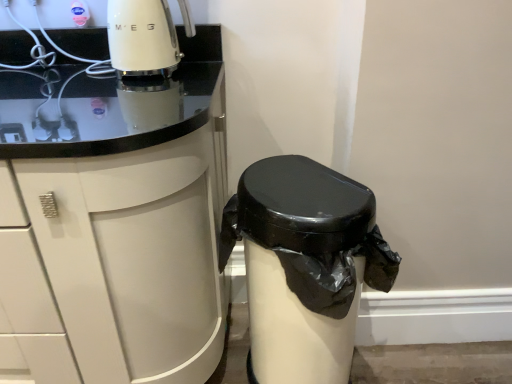
What do you see at coordinates (304, 266) in the screenshot? The width and height of the screenshot is (512, 384). I see `black plastic waste bin at lower right` at bounding box center [304, 266].

At what (x,y) coordinates should I click in order to perform the action: click on black plastic waste bin at lower right. Please return your answer as a coordinate pair (x, y). The width and height of the screenshot is (512, 384). Looking at the image, I should click on (304, 266).

What is the approximate height of white glossy cabinet at upper left?

The height of white glossy cabinet at upper left is 3.31 feet.

The width and height of the screenshot is (512, 384). Identify the location of white glossy cabinet at upper left. (135, 255).

The image size is (512, 384). Describe the element at coordinates (135, 255) in the screenshot. I see `white glossy cabinet at upper left` at that location.

Find the location of a particular element. The width and height of the screenshot is (512, 384). black plastic waste bin at lower right is located at coordinates (304, 266).

Considering the relative positions of white glossy cabinet at upper left and black plastic waste bin at lower right in the image provided, is white glossy cabinet at upper left to the left of black plastic waste bin at lower right from the viewer's perspective?

Correct, you'll find white glossy cabinet at upper left to the left of black plastic waste bin at lower right.

Which object is closer to the camera taking this photo, white glossy cabinet at upper left or black plastic waste bin at lower right?

white glossy cabinet at upper left is in front.

Which is behind, point (189, 145) or point (252, 195)?

Positioned behind is point (252, 195).

From the image's perspective, is white glossy cabinet at upper left on top of black plastic waste bin at lower right?

Yes, from the image's perspective, white glossy cabinet at upper left is on top of black plastic waste bin at lower right.

From a real-world perspective, is white glossy cabinet at upper left over black plastic waste bin at lower right?

Yes.

Between white glossy cabinet at upper left and black plastic waste bin at lower right, which one has smaller width?

black plastic waste bin at lower right.

Between white glossy cabinet at upper left and black plastic waste bin at lower right, which one has less height?

black plastic waste bin at lower right is shorter.

Considering the sizes of objects white glossy cabinet at upper left and black plastic waste bin at lower right in the image provided, who is bigger, white glossy cabinet at upper left or black plastic waste bin at lower right?

Bigger between the two is white glossy cabinet at upper left.

Is white glossy cabinet at upper left outside of black plastic waste bin at lower right?

That's correct, white glossy cabinet at upper left is outside of black plastic waste bin at lower right.

Is white glossy cabinet at upper left next to black plastic waste bin at lower right?

No, white glossy cabinet at upper left is not in contact with black plastic waste bin at lower right.

Is white glossy cabinet at upper left turned away from black plastic waste bin at lower right?

No, white glossy cabinet at upper left is not facing away from black plastic waste bin at lower right.

How far apart are white glossy cabinet at upper left and black plastic waste bin at lower right?

They are 9.58 inches apart.

Locate an element on the screen. cabinetry in front of the black plastic waste bin at lower right is located at coordinates (135, 255).

Considering the relative positions of black plastic waste bin at lower right and white glossy cabinet at upper left in the image provided, is black plastic waste bin at lower right to the left or to the right of white glossy cabinet at upper left?

In the image, black plastic waste bin at lower right appears on the right side of white glossy cabinet at upper left.

Who is more distant, black plastic waste bin at lower right or white glossy cabinet at upper left?

black plastic waste bin at lower right is more distant.

Does point (356, 200) come in front of point (145, 248)?

No, (356, 200) is further to viewer.

From the image's perspective, which object appears higher, black plastic waste bin at lower right or white glossy cabinet at upper left?

white glossy cabinet at upper left appears higher in the image.

Consider the image. From a real-world perspective, is black plastic waste bin at lower right on white glossy cabinet at upper left?

No, from a real-world perspective, black plastic waste bin at lower right is not above white glossy cabinet at upper left.

Considering the sizes of black plastic waste bin at lower right and white glossy cabinet at upper left in the image, is black plastic waste bin at lower right wider or thinner than white glossy cabinet at upper left?

black plastic waste bin at lower right is thinner than white glossy cabinet at upper left.

Does black plastic waste bin at lower right have a lesser height compared to white glossy cabinet at upper left?

Yes, black plastic waste bin at lower right is shorter than white glossy cabinet at upper left.

Can you confirm if black plastic waste bin at lower right is bigger than white glossy cabinet at upper left?

No, black plastic waste bin at lower right is not bigger than white glossy cabinet at upper left.

In the scene shown: Would you say black plastic waste bin at lower right contains white glossy cabinet at upper left?

No, white glossy cabinet at upper left is not a part of black plastic waste bin at lower right.

Does black plastic waste bin at lower right touch white glossy cabinet at upper left?

No, black plastic waste bin at lower right is not in contact with white glossy cabinet at upper left.

Is white glossy cabinet at upper left at the back of black plastic waste bin at lower right?

That's not correct — black plastic waste bin at lower right is not looking away from white glossy cabinet at upper left.

Consider the image. How different are the orientations of black plastic waste bin at lower right and white glossy cabinet at upper left in degrees?

They differ by 1.61 degrees in their facing directions.

Locate an element on the screen. The width and height of the screenshot is (512, 384). waste container located below the white glossy cabinet at upper left (from the image's perspective) is located at coordinates (304, 266).

This screenshot has width=512, height=384. I want to click on waste container located on the right of white glossy cabinet at upper left, so click(304, 266).

The image size is (512, 384). I want to click on cabinetry above the black plastic waste bin at lower right (from the image's perspective), so click(x=135, y=255).